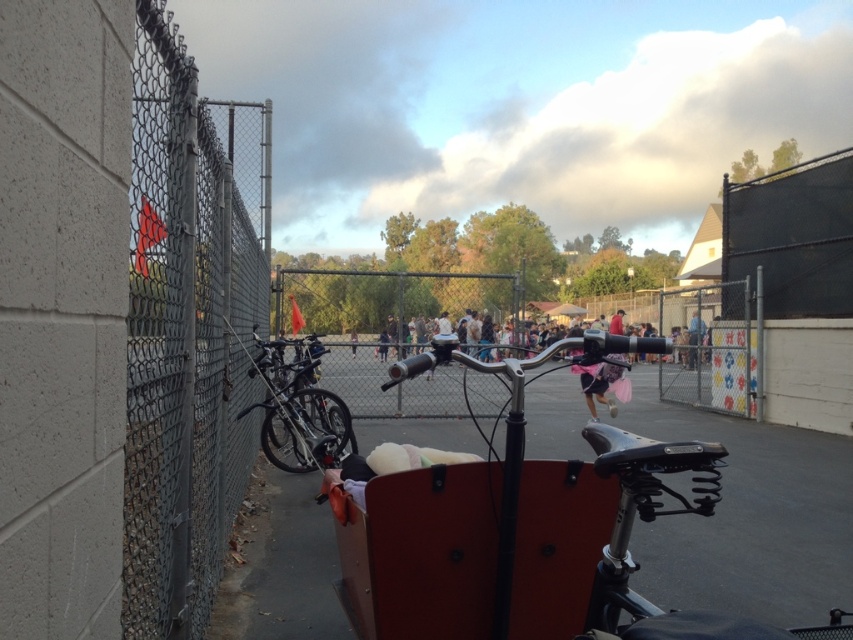
Question: Does gray chain-link fence at left appear under pink fabric at center?

Choices:
 (A) yes
 (B) no

Answer: (A)

Question: Is gray chain-link fence at left to the right of pink fabric at center from the viewer's perspective?

Choices:
 (A) no
 (B) yes

Answer: (B)

Question: Which object appears closest to the camera in this image?

Choices:
 (A) black mesh fence at upper right
 (B) gray chain-link fence at left

Answer: (B)

Question: Which is nearer to the gray chain-link fence at left?

Choices:
 (A) shiny black bicycle at left
 (B) black mesh fence at upper right

Answer: (A)

Question: In this image, where is shiny black bicycle at left located relative to pink fabric at center?

Choices:
 (A) above
 (B) below

Answer: (B)

Question: Which object is positioned closest to the black mesh fence at upper right?

Choices:
 (A) gray chain-link fence at left
 (B) pink fabric at center
 (C) shiny black bicycle at left

Answer: (B)